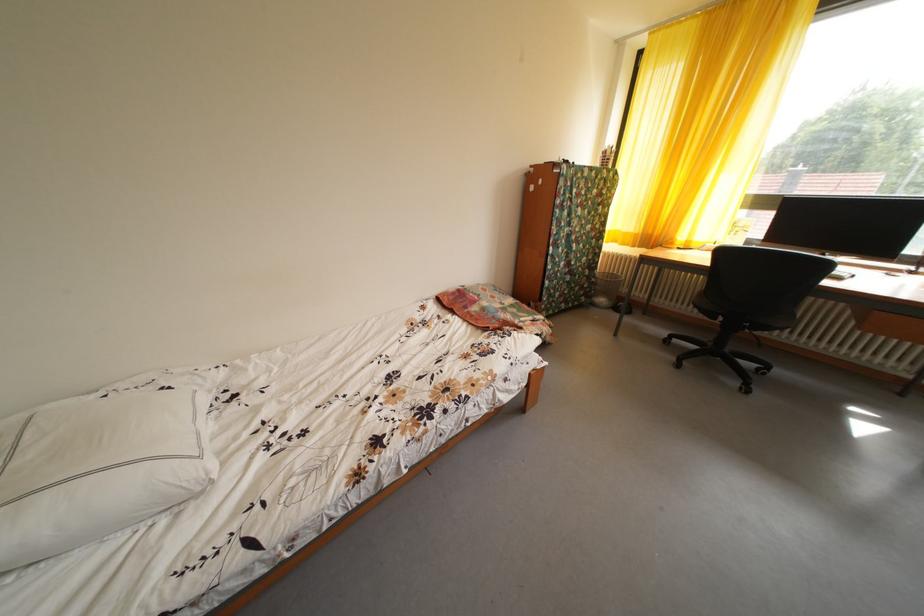
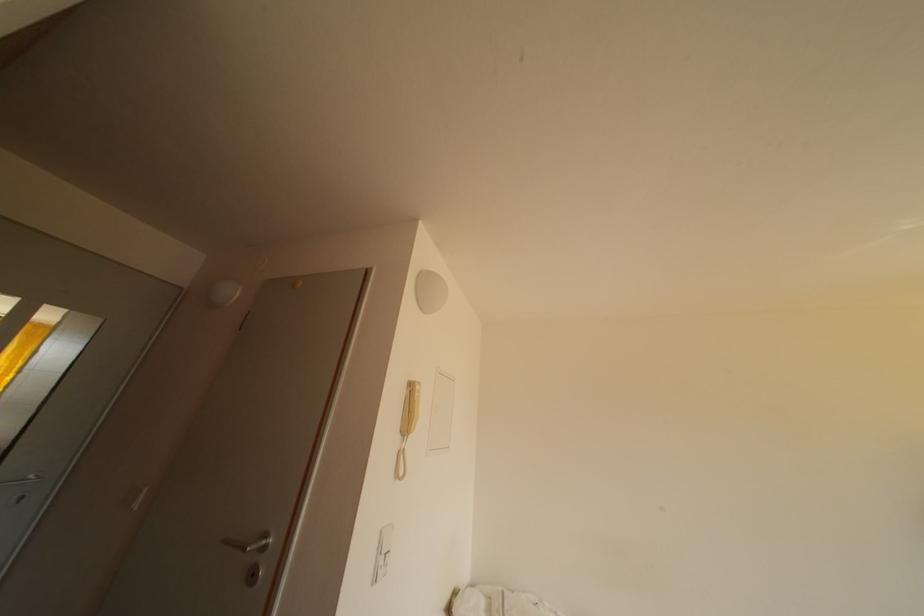
The images are taken continuously from a first-person perspective. In which direction is your viewpoint rotating?

The rotation direction of the camera is left-up.